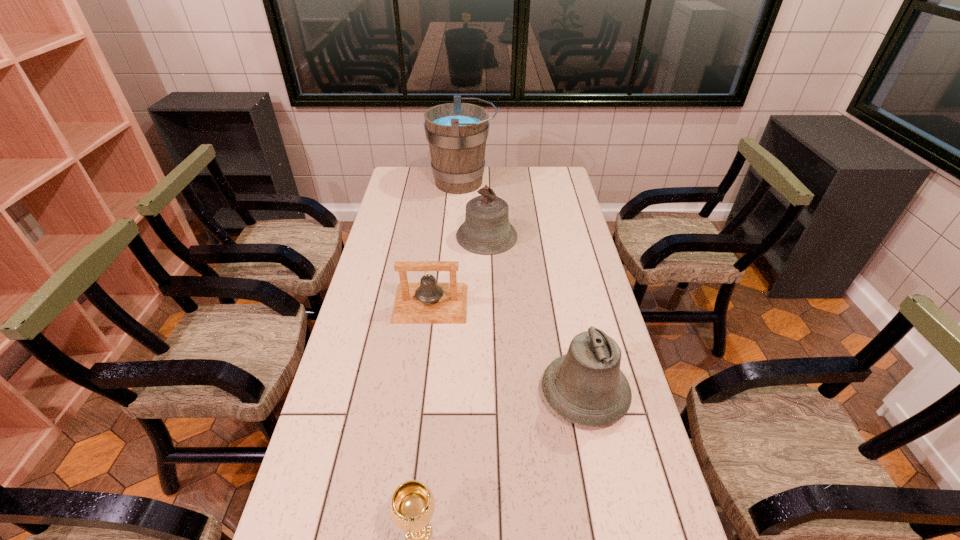
The image size is (960, 540). I want to click on free location located on the front of the shortest bell, so click(421, 377).

You are a GUI agent. You are given a task and a screenshot of the screen. Output one action in this format:
    pyautogui.click(x=<x>, y=<y>)
    Task: Click on the object that is at the far edge
    
    Given the screenshot: What is the action you would take?
    pyautogui.click(x=457, y=132)

Where is `object situated at the left edge`? The height and width of the screenshot is (540, 960). object situated at the left edge is located at coordinates (427, 302).

I want to click on object present at the right edge, so click(585, 386).

In the image, there is a desktop. At what (x,y) coordinates should I click in order to perform the action: click on free space at the far edge. Please return your answer as a coordinate pair (x, y). Looking at the image, I should click on (502, 171).

The height and width of the screenshot is (540, 960). I want to click on vacant space at the left edge of the desktop, so click(x=390, y=272).

In the image, there is a desktop. What are the coordinates of `vacant space at the right edge` in the screenshot? It's located at (572, 206).

Where is `free region at the far right corner of the desktop`? The height and width of the screenshot is (540, 960). free region at the far right corner of the desktop is located at coordinates (558, 191).

The height and width of the screenshot is (540, 960). What are the coordinates of `vacant space that is in between the rightmost object and the farthest bell` in the screenshot? It's located at (536, 315).

Locate an element on the screen. Image resolution: width=960 pixels, height=540 pixels. unoccupied position between the second nearest bell and the rightmost object is located at coordinates (508, 349).